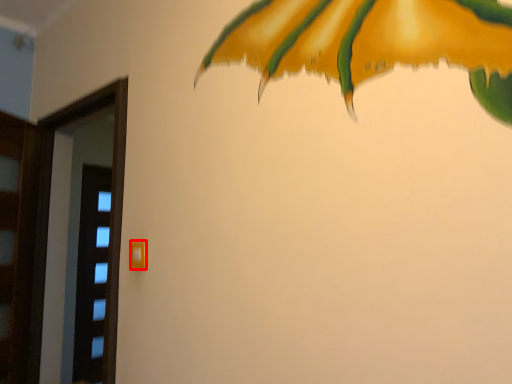
Question: From the image's perspective, where is door handle (annotated by the red box) located in relation to screen door in the image?

Choices:
 (A) below
 (B) above

Answer: (B)